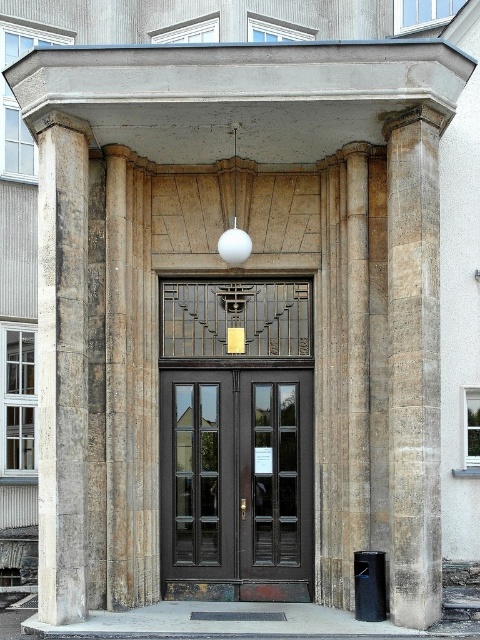
Which is below, light beige stone column at left or dark wood door at center?

dark wood door at center

Does light beige stone column at left have a lesser width compared to dark wood door at center?

Indeed, light beige stone column at left has a lesser width compared to dark wood door at center.

Describe the element at coordinates (61, 369) in the screenshot. I see `light beige stone column at left` at that location.

Where is `light beige stone column at left`? Image resolution: width=480 pixels, height=640 pixels. light beige stone column at left is located at coordinates (61, 369).

Between point (434, 385) and point (37, 396), which one is positioned in front?

Point (434, 385)

Identify the location of stone textured column at right. (414, 365).

Between point (291, 472) and point (231, 227), which one is positioned behind?

Point (231, 227)

Based on the photo, can you confirm if matte black door at center is positioned to the left of white matte sphere at center?

Yes, matte black door at center is to the left of white matte sphere at center.

Between point (300, 588) and point (235, 180), which one is positioned behind?

Positioned behind is point (235, 180).

The height and width of the screenshot is (640, 480). In order to click on matte black door at center in this screenshot , I will do `click(237, 484)`.